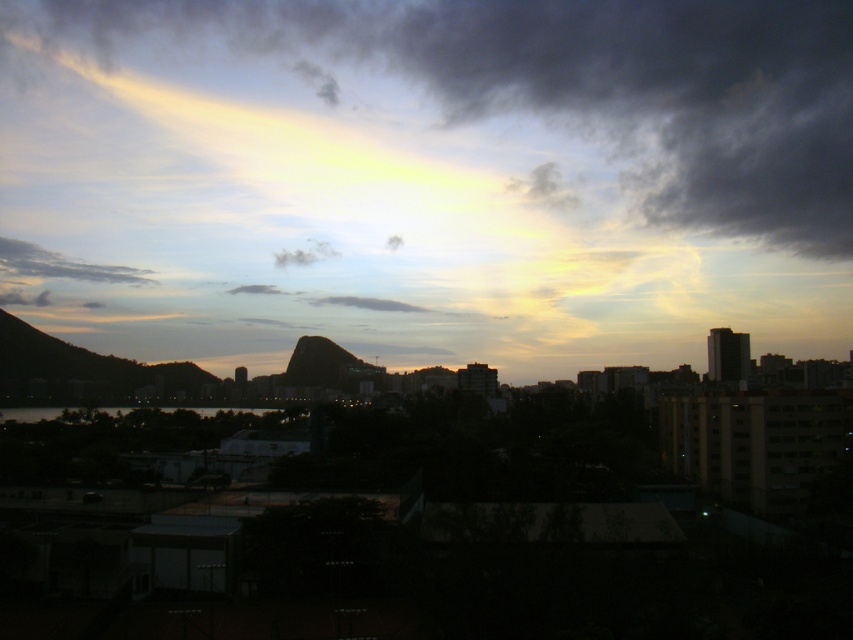
Is cloudy sky at upper center above transparent water at lower center?

Correct, cloudy sky at upper center is located above transparent water at lower center.

Does cloudy sky at upper center have a greater width compared to transparent water at lower center?

Yes, cloudy sky at upper center is wider than transparent water at lower center.

Measure the distance between point [515,49] and camera.

435.98 meters

Find the location of a particular element. Image resolution: width=853 pixels, height=640 pixels. cloudy sky at upper center is located at coordinates (569, 84).

Who is positioned more to the left, gray cotton cloud at upper left or gray matte cloud at center?

gray cotton cloud at upper left is more to the left.

Is point (18, 256) in front of point (376, 307)?

No, (18, 256) is further to viewer.

Locate an element on the screen. The width and height of the screenshot is (853, 640). gray cotton cloud at upper left is located at coordinates (62, 264).

Is transparent water at lower center smaller than white fluffy cloud at center?

No.

Between transparent water at lower center and white fluffy cloud at center, which one appears on the right side from the viewer's perspective?

From the viewer's perspective, white fluffy cloud at center appears more on the right side.

Who is more forward, (219, 408) or (294, 250)?

Point (219, 408)

Locate an element on the screen. The image size is (853, 640). transparent water at lower center is located at coordinates (189, 410).